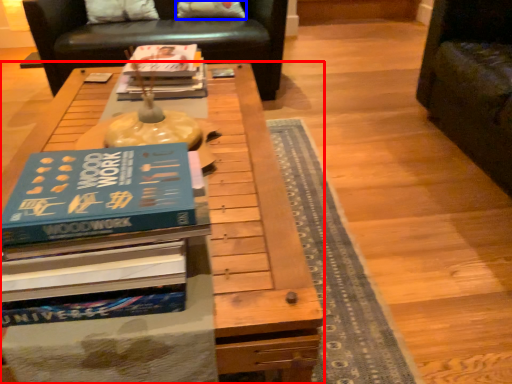
Question: Which object appears closest to the camera in this image, table (highlighted by a red box) or pillow (highlighted by a blue box)?

Choices:
 (A) table
 (B) pillow

Answer: (A)